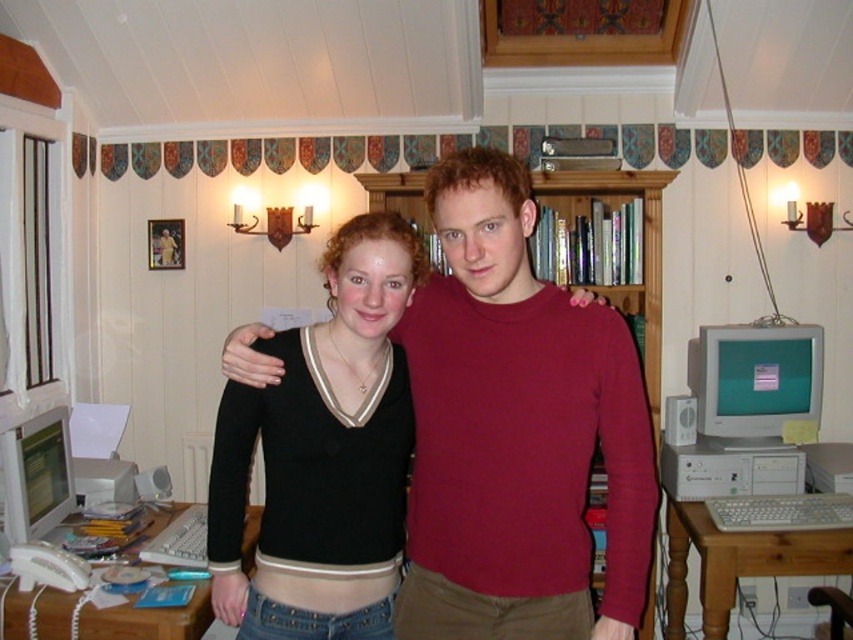
You are organizing your home office and need to place a new lamp on the highest point between the black jersey at center and the wooden bookshelf at center. Which object should you choose?

The wooden bookshelf at center is higher than the black jersey at center, so you should place the lamp on the wooden bookshelf at center.

You are organizing a small event and need to place a 1.2 meter wide banner between the black jersey at center and the white plastic desktop computer at lower right. Can the space between them accommodate the banner?

The black jersey at center is bigger than the white plastic desktop computer at lower right, but the exact distance between them isn

You are standing in the cozy indoor setting and want to move from the point at coordinates point (259,616) to the point at coordinates point (405,172). Which direction should you move to get closer to your destination?

To move from point (259,616) to point (405,172), you should move towards the left and slightly upward since point (259,616) is in front of point (405,172).